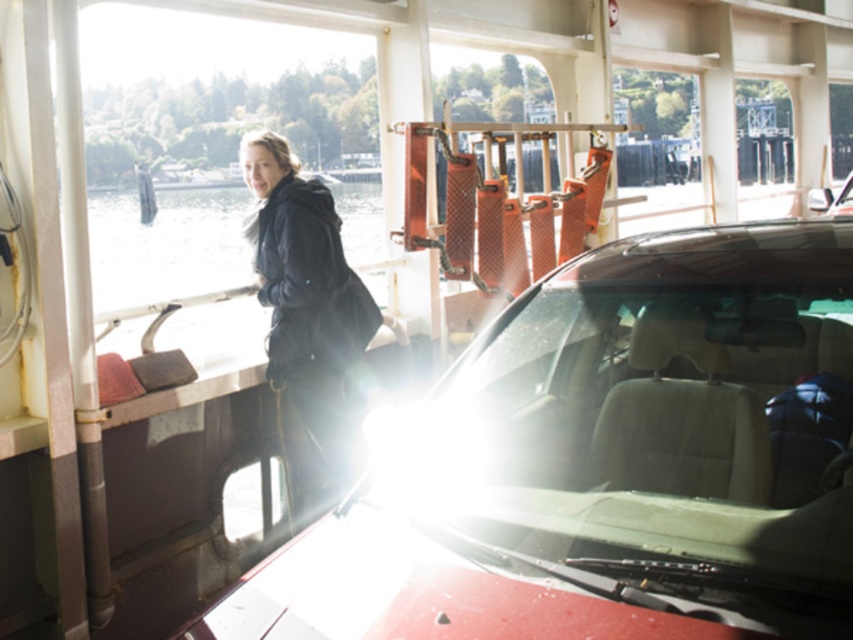
Question: Is transparent glass windshield at center bigger than black matte jacket at left?

Choices:
 (A) yes
 (B) no

Answer: (A)

Question: Can you confirm if transparent glass windshield at center is smaller than black matte jacket at left?

Choices:
 (A) no
 (B) yes

Answer: (A)

Question: Which of the following is the closest to the observer?

Choices:
 (A) black matte jacket at left
 (B) transparent glass windshield at center

Answer: (B)

Question: Which of the following is the farthest from the observer?

Choices:
 (A) (432, 532)
 (B) (260, 301)

Answer: (B)

Question: In this image, where is transparent glass windshield at center located relative to black matte jacket at left?

Choices:
 (A) above
 (B) below

Answer: (B)